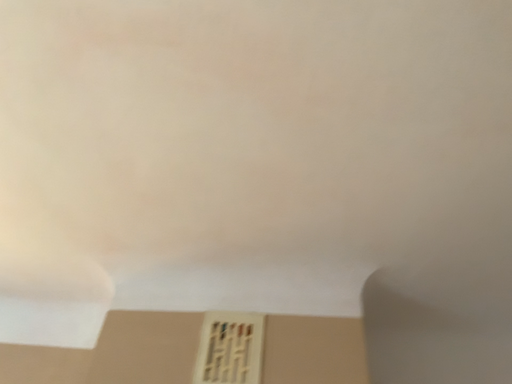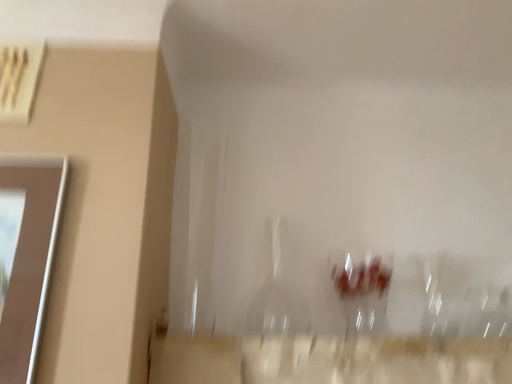
Question: Which way did the camera rotate in the video?

Choices:
 (A) rotated downward
 (B) rotated upward

Answer: (A)